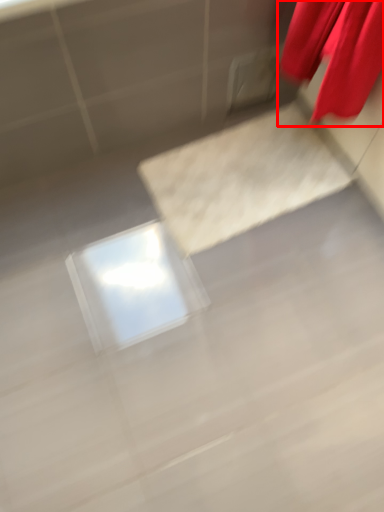
Question: Where is curtain (annotated by the red box) located in relation to concrete in the image?

Choices:
 (A) left
 (B) right

Answer: (B)